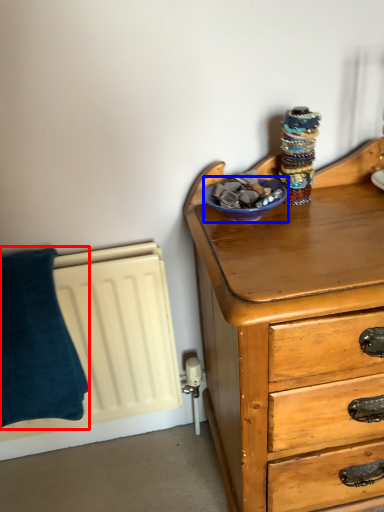
Question: Which object appears closest to the camera in this image, pillow (highlighted by a red box) or glass bowl (highlighted by a blue box)?

Choices:
 (A) pillow
 (B) glass bowl

Answer: (B)